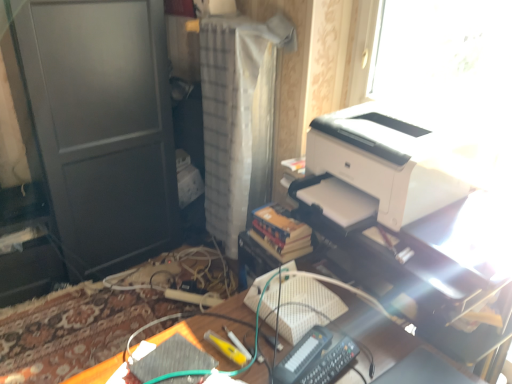
Question: Is white textured curtain at center shorter than wooden desk at center?

Choices:
 (A) yes
 (B) no

Answer: (B)

Question: Would you say white textured curtain at center is outside wooden desk at center?

Choices:
 (A) yes
 (B) no

Answer: (A)

Question: Is white textured curtain at center turned away from wooden desk at center?

Choices:
 (A) no
 (B) yes

Answer: (A)

Question: Can you confirm if white textured curtain at center is smaller than wooden desk at center?

Choices:
 (A) yes
 (B) no

Answer: (A)

Question: Is white textured curtain at center positioned in front of wooden desk at center?

Choices:
 (A) no
 (B) yes

Answer: (A)

Question: Considering the relative positions of white textured curtain at center and wooden desk at center in the image provided, is white textured curtain at center to the right of wooden desk at center from the viewer's perspective?

Choices:
 (A) yes
 (B) no

Answer: (B)

Question: Does wooden desk at center have a smaller size compared to white matte printer at upper right?

Choices:
 (A) no
 (B) yes

Answer: (A)

Question: Is white matte printer at upper right at the back of wooden desk at center?

Choices:
 (A) no
 (B) yes

Answer: (A)

Question: From a real-world perspective, is wooden desk at center beneath white matte printer at upper right?

Choices:
 (A) no
 (B) yes

Answer: (B)

Question: Is wooden desk at center at the right side of white matte printer at upper right?

Choices:
 (A) yes
 (B) no

Answer: (B)

Question: Is wooden desk at center at the left side of white matte printer at upper right?

Choices:
 (A) no
 (B) yes

Answer: (B)

Question: Considering the relative sizes of wooden desk at center and white matte printer at upper right in the image provided, is wooden desk at center thinner than white matte printer at upper right?

Choices:
 (A) yes
 (B) no

Answer: (B)

Question: Is the position of wooden desk at center less distant than that of white glossy printer at upper right?

Choices:
 (A) no
 (B) yes

Answer: (B)